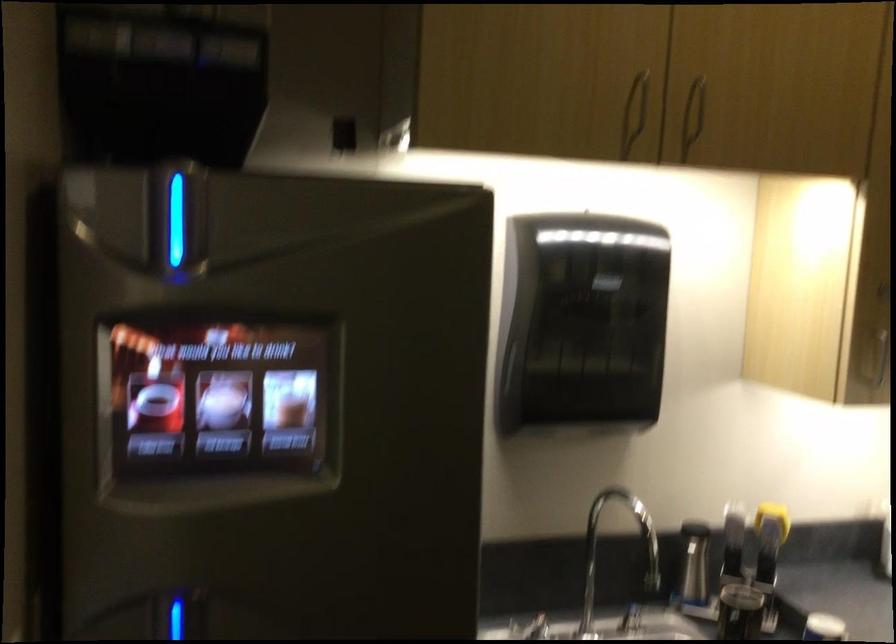
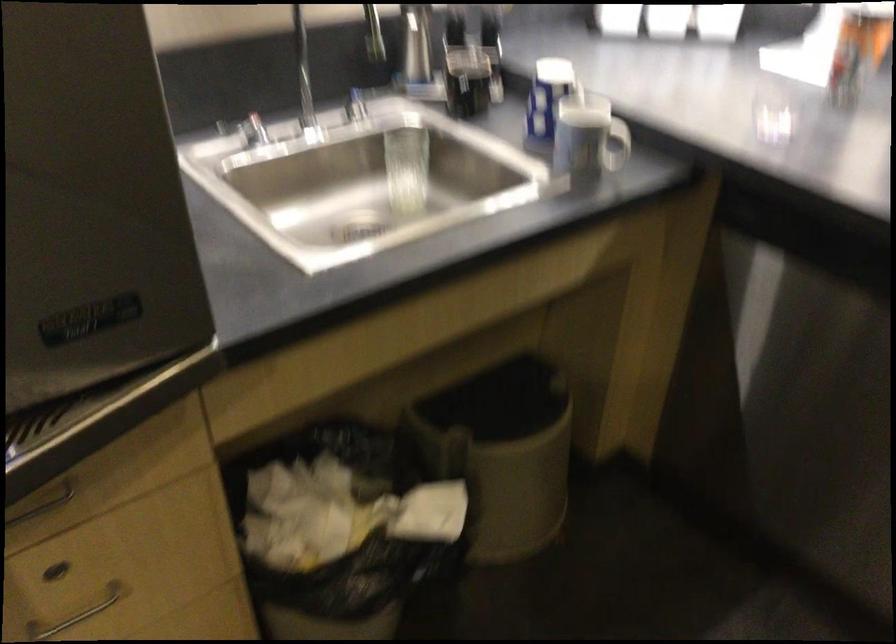
The first image is from the beginning of the video and the second image is from the end. How did the camera likely rotate when shooting the video?

The camera rotated toward right-down.